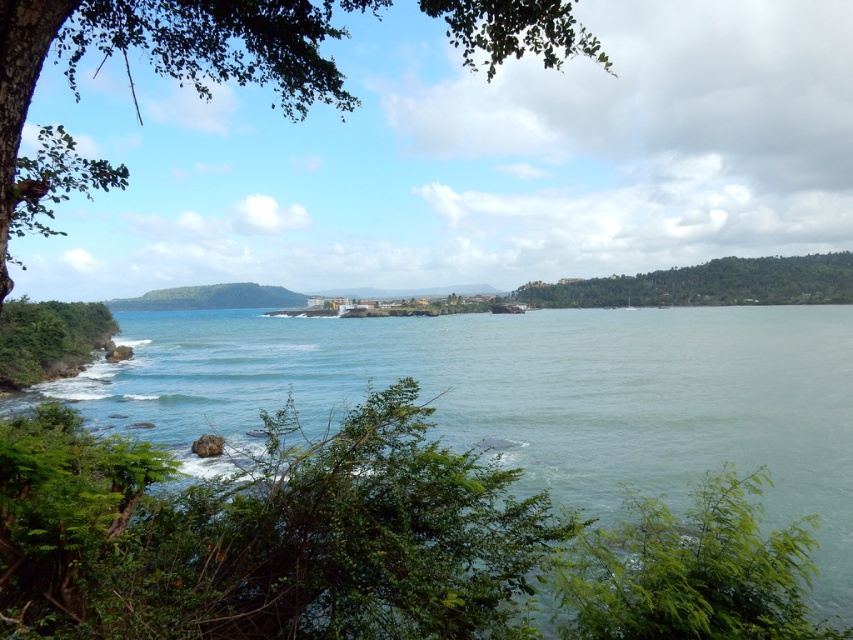
Question: Which object is farther from the camera taking this photo?

Choices:
 (A) clear blue water at center
 (B) green leafy shrub at lower right

Answer: (A)

Question: Is green leafy tree at upper left to the left of green leafy shrub at lower right from the viewer's perspective?

Choices:
 (A) yes
 (B) no

Answer: (A)

Question: Which of the following is the closest to the observer?

Choices:
 (A) green leafy tree at upper left
 (B) green leafy tree at right
 (C) clear blue water at center
 (D) green leafy shrub at lower right

Answer: (A)

Question: Considering the relative positions of clear blue water at center and green leafy shrub at lower right in the image provided, where is clear blue water at center located with respect to green leafy shrub at lower right?

Choices:
 (A) right
 (B) left

Answer: (A)

Question: Which of the following is the closest to the observer?

Choices:
 (A) (704, 547)
 (B) (566, 316)
 (C) (712, 266)

Answer: (A)

Question: Considering the relative positions of green leafy tree at upper left and green leafy shrub at lower right in the image provided, where is green leafy tree at upper left located with respect to green leafy shrub at lower right?

Choices:
 (A) left
 (B) right

Answer: (A)